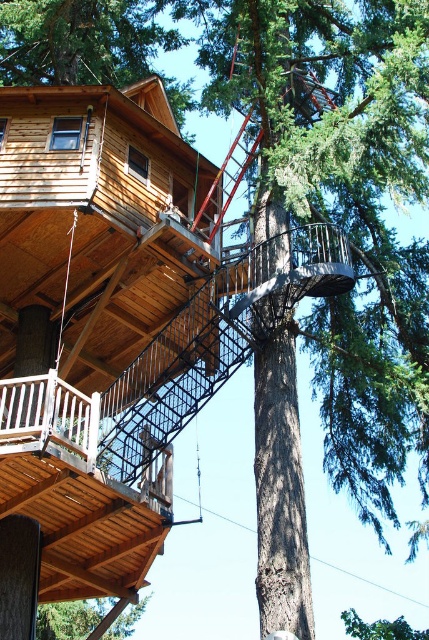
Question: Among these objects, which one is nearest to the camera?

Choices:
 (A) green leafy tree at upper center
 (B) green wood tree at lower left

Answer: (A)

Question: Where is green wood tree at lower left located in relation to green leafy tree at upper center in the image?

Choices:
 (A) right
 (B) left

Answer: (B)

Question: Is green wood tree at lower left wider than green leafy tree at upper center?

Choices:
 (A) yes
 (B) no

Answer: (B)

Question: Is green wood tree at lower left below green leafy tree at upper center?

Choices:
 (A) no
 (B) yes

Answer: (A)